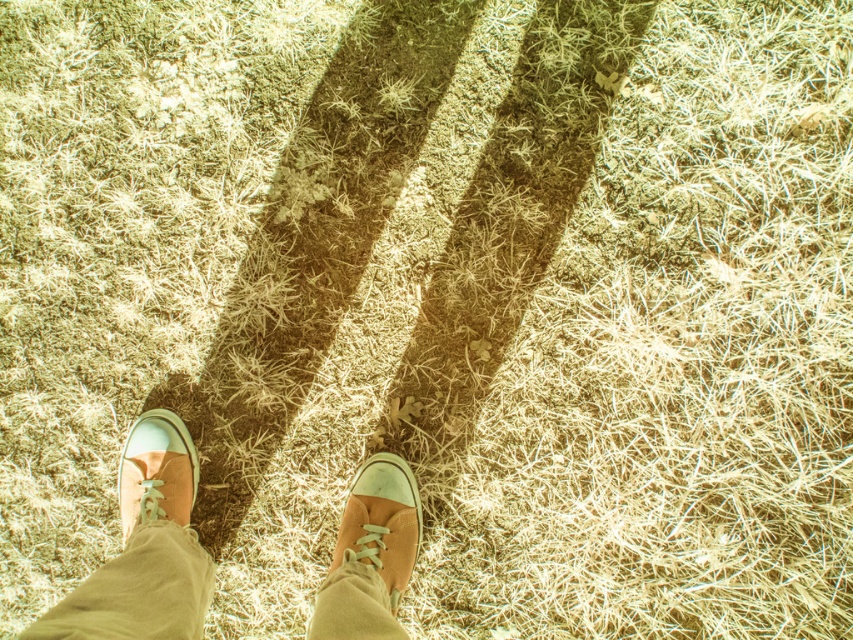
Question: Observing the image, what is the correct spatial positioning of khaki pants at lower left in reference to matte canvas shoe at center?

Choices:
 (A) left
 (B) right

Answer: (A)

Question: Is the position of tan canvas shoes at center less distant than that of matte canvas shoe at center?

Choices:
 (A) no
 (B) yes

Answer: (B)

Question: Which point is closer to the camera taking this photo?

Choices:
 (A) (380, 458)
 (B) (131, 628)
 (C) (172, 436)
 (D) (370, 499)

Answer: (B)

Question: Among these points, which one is farthest from the camera?

Choices:
 (A) (122, 513)
 (B) (196, 595)
 (C) (364, 496)
 (D) (132, 515)

Answer: (A)

Question: Can you confirm if khaki pants at lower left is positioned to the left of matte canvas shoe at center?

Choices:
 (A) yes
 (B) no

Answer: (A)

Question: Which object is closer to the camera taking this photo?

Choices:
 (A) tan canvas shoes at center
 (B) khaki pants at lower left

Answer: (B)